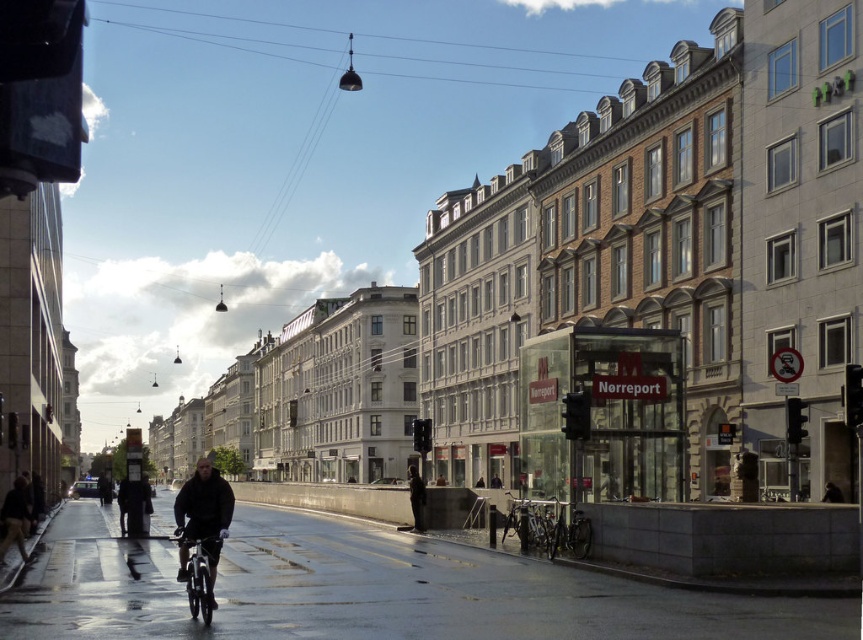
You are a delivery person who needs to load a package onto the green matte bicycle at lower center and the dark gray jacket at center. Which object requires a larger space for the package?

The dark gray jacket at center requires a larger space for the package since the green matte bicycle at lower center is smaller than it.

You are a delivery person who needs to place a small package between the dark matte jacket at lower left and the metallic silver bicycle at lower center. The package requires 2 feet of space. Can you fit it there?

The dark matte jacket at lower left is 8.06 feet from the metallic silver bicycle at lower center, so yes, the package requiring 2 feet of space can be placed between them since there is enough space available.

You are a delivery person who needs to secure a package on the green matte bicycle at lower center. The dark gray jacket at center is blocking access to the rear rack. Can you move the jacket to the side to make space?

The green matte bicycle at lower center is located above the dark gray jacket at center, so the jacket is below the bicycle. Since the jacket is already positioned lower, you can easily move it aside to access the rear rack without any obstruction.